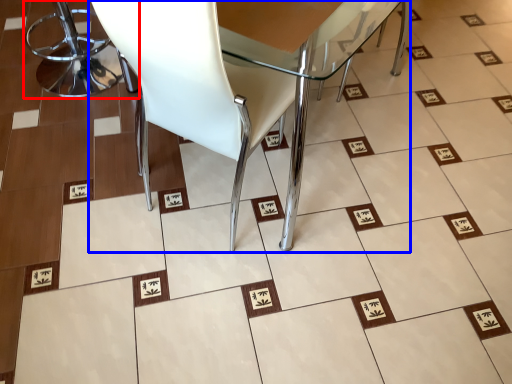
Question: Which point is closer to the camera, chair (highlighted by a red box) or chair (highlighted by a blue box)?

Choices:
 (A) chair
 (B) chair

Answer: (B)